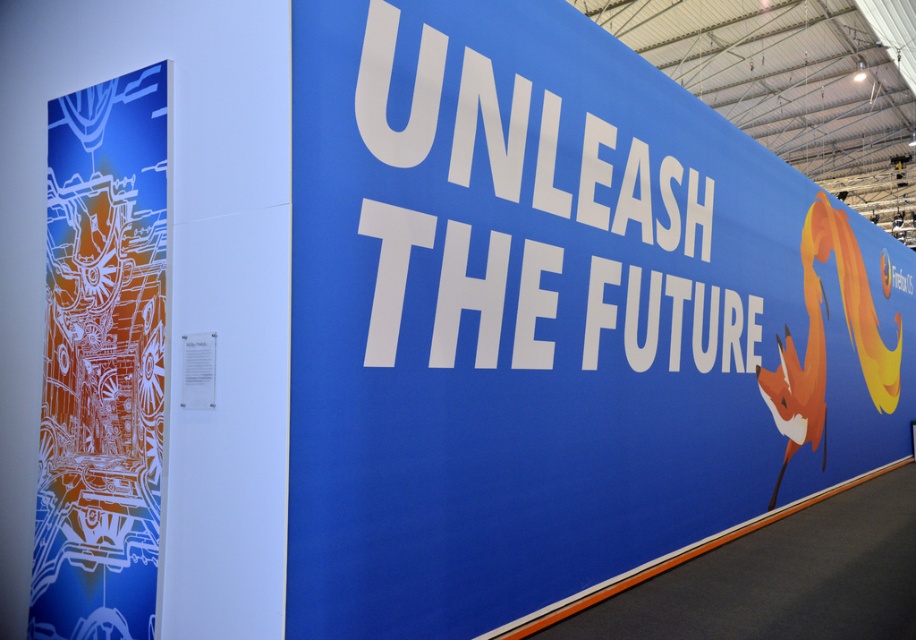
Question: Which of the following is the farthest from the observer?

Choices:
 (A) white glossy art at left
 (B) blue matte sign at upper right

Answer: (A)

Question: Can you confirm if blue matte sign at upper right is positioned to the left of white glossy art at left?

Choices:
 (A) yes
 (B) no

Answer: (B)

Question: Does blue matte sign at upper right have a smaller size compared to white glossy art at left?

Choices:
 (A) yes
 (B) no

Answer: (B)

Question: Does blue matte sign at upper right have a smaller size compared to white glossy art at left?

Choices:
 (A) no
 (B) yes

Answer: (A)